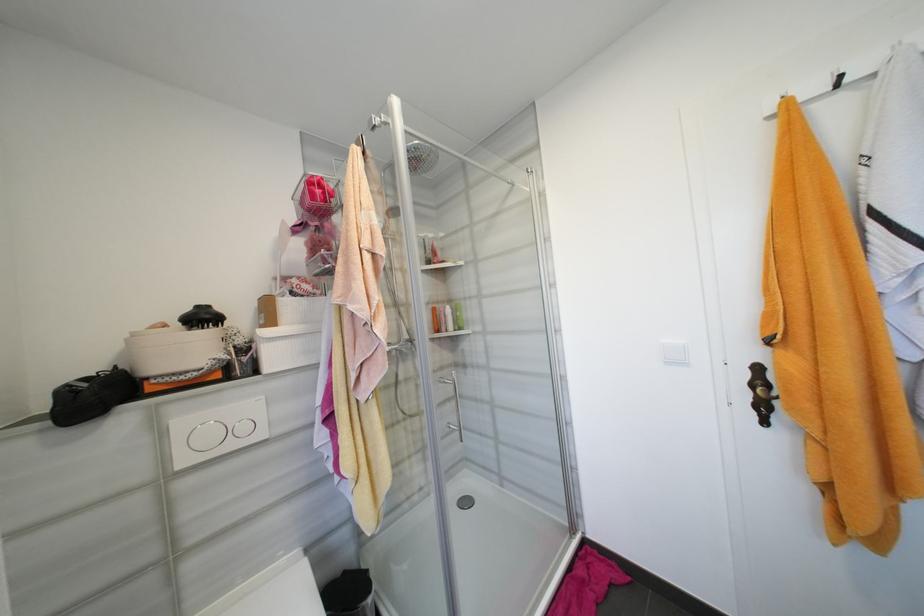
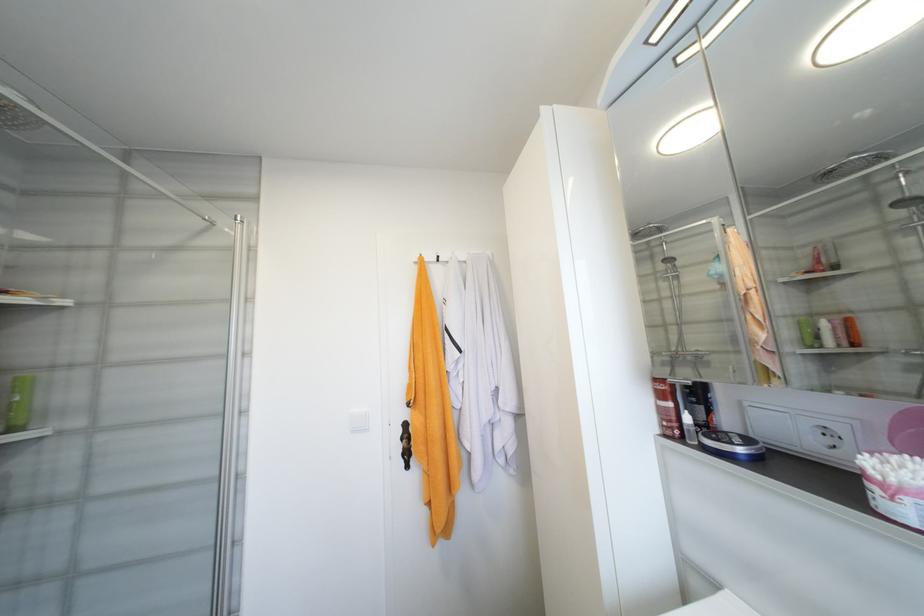
The point at (847, 78) is marked in the first image. Where is the corresponding point in the second image?

(444, 257)